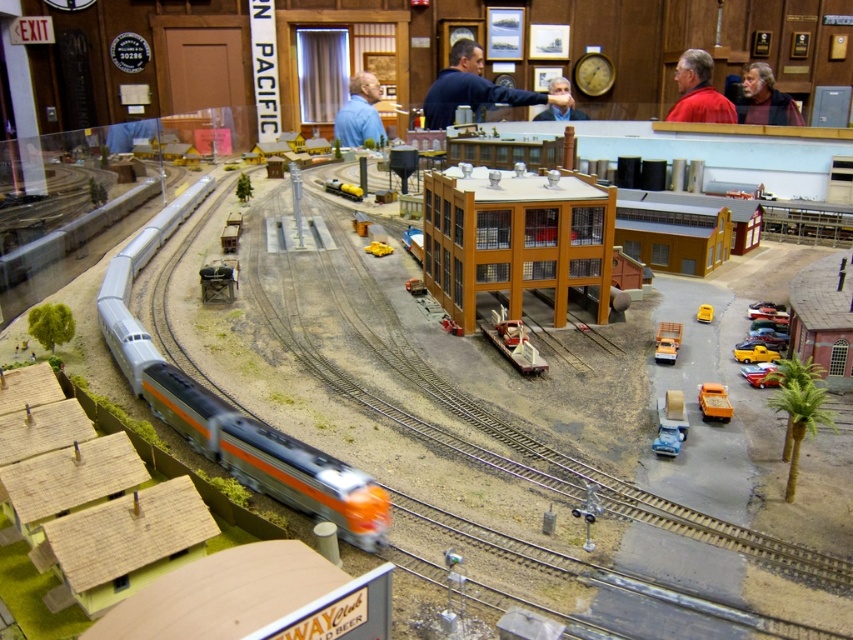
Is dark blue shirt at center to the left of bearded man at upper right from the viewer's perspective?

Correct, you'll find dark blue shirt at center to the left of bearded man at upper right.

Locate an element on the screen. dark blue shirt at center is located at coordinates (474, 88).

This screenshot has width=853, height=640. What are the coordinates of `blue fabric shirt at center` in the screenshot? It's located at (358, 113).

Who is higher up, blue fabric shirt at center or matte black face mask at center?

blue fabric shirt at center

Measure the distance between blue fabric shirt at center and camera.

blue fabric shirt at center is 24.19 meters away from camera.

The width and height of the screenshot is (853, 640). I want to click on blue fabric shirt at center, so click(358, 113).

Is dark blue shirt at center to the right of red matte shirt at upper right from the viewer's perspective?

In fact, dark blue shirt at center is to the left of red matte shirt at upper right.

Is dark blue shirt at center taller than red matte shirt at upper right?

In fact, dark blue shirt at center may be shorter than red matte shirt at upper right.

At what (x,y) coordinates should I click in order to perform the action: click on dark blue shirt at center. Please return your answer as a coordinate pair (x, y). The width and height of the screenshot is (853, 640). Looking at the image, I should click on (474, 88).